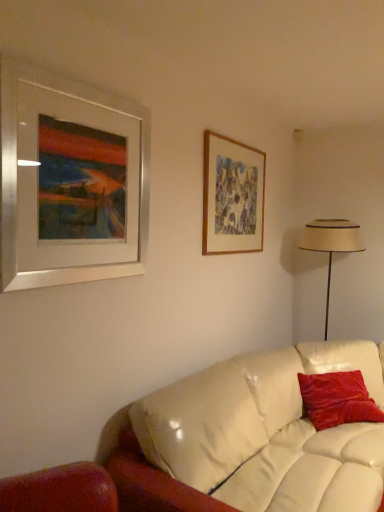
Question: From the image's perspective, does velvet red pillow at right appear lower than beige fabric lampshade at right?

Choices:
 (A) no
 (B) yes

Answer: (B)

Question: Is velvet red pillow at right closer to camera compared to beige fabric lampshade at right?

Choices:
 (A) no
 (B) yes

Answer: (B)

Question: Is beige fabric lampshade at right a part of velvet red pillow at right?

Choices:
 (A) yes
 (B) no

Answer: (B)

Question: From the image's perspective, is velvet red pillow at right on beige fabric lampshade at right?

Choices:
 (A) no
 (B) yes

Answer: (A)

Question: From a real-world perspective, is velvet red pillow at right on beige fabric lampshade at right?

Choices:
 (A) no
 (B) yes

Answer: (A)

Question: Is wooden picture frame at upper right, which is counted as the second picture frame, starting from the left, taller or shorter than silver metallic picture frame at upper left, positioned as the 2th picture frame in back-to-front order?

Choices:
 (A) short
 (B) tall

Answer: (A)

Question: Looking at the image, does wooden picture frame at upper right, which is counted as the second picture frame, starting from the front, seem bigger or smaller compared to silver metallic picture frame at upper left, which is the second picture frame in right-to-left order?

Choices:
 (A) small
 (B) big

Answer: (A)

Question: From a real-world perspective, is wooden picture frame at upper right, placed as the 1th picture frame when sorted from right to left, positioned above or below silver metallic picture frame at upper left, positioned as the 2th picture frame in back-to-front order?

Choices:
 (A) below
 (B) above

Answer: (B)

Question: Does point (205, 164) appear closer or farther from the camera than point (64, 83)?

Choices:
 (A) farther
 (B) closer

Answer: (A)

Question: Is point (340, 231) closer or farther from the camera than point (99, 271)?

Choices:
 (A) closer
 (B) farther

Answer: (B)

Question: Looking at their shapes, would you say beige fabric lampshade at right is wider or thinner than silver metallic picture frame at upper left, arranged as the first picture frame when viewed from the left?

Choices:
 (A) thin
 (B) wide

Answer: (B)

Question: Which is correct: beige fabric lampshade at right is inside silver metallic picture frame at upper left, which is the second picture frame in right-to-left order, or outside of it?

Choices:
 (A) inside
 (B) outside

Answer: (B)

Question: Considering the positions of beige fabric lampshade at right and silver metallic picture frame at upper left, which is the second picture frame in right-to-left order, in the image, is beige fabric lampshade at right taller or shorter than silver metallic picture frame at upper left, which is the second picture frame in right-to-left order,?

Choices:
 (A) short
 (B) tall

Answer: (B)

Question: From the image's perspective, is beige fabric lampshade at right located above or below velvet red pillow at right?

Choices:
 (A) above
 (B) below

Answer: (A)

Question: Does point (327, 220) appear closer or farther from the camera than point (319, 408)?

Choices:
 (A) closer
 (B) farther

Answer: (B)